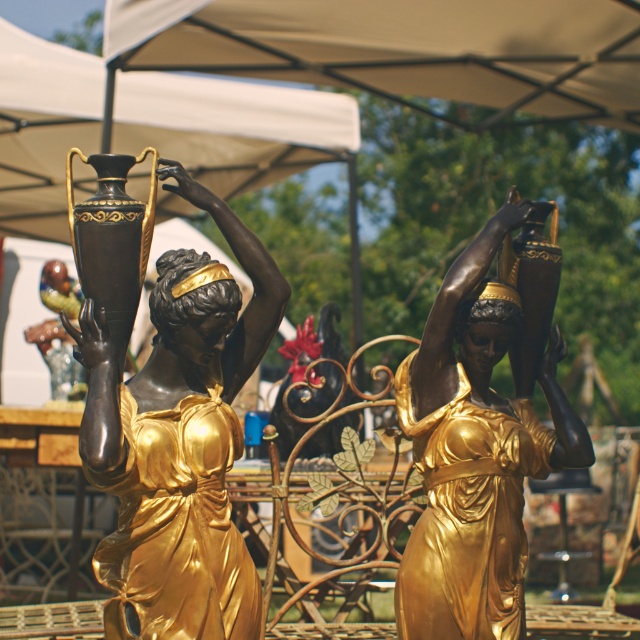
You are a photographer trying to capture a closeup of the statue with the point at (122,545). However, the other statue at point (461,602) is blocking your view. Can you adjust your position to get a clear shot of the first point without the second point being in the frame?

Yes, since point (122,545) is closer to the camera than point (461,602), you can move your camera position slightly to the side or lower your angle to focus on the closer point while avoiding the obstruction from the farther point.